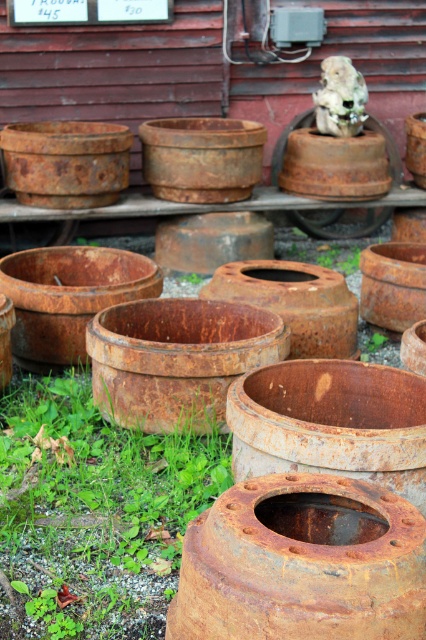
You are standing at the center of the image and want to walk towards the green grass at lower left. In which direction should you move relative to your current position?

Since the green grass at lower left is located at point (97, 508) in 2D coordinates, you should move diagonally towards the lower left direction from your current position at the center to reach it.

You are standing at the lower left corner of the image and want to walk towards the rusty metal tire at center. Is the green grass at lower left blocking your path?

The green grass at lower left is in front of the rusty metal tire at center, so it is blocking your path.

You are a gardener planning to place a new decorative item in the garden. You have a rusty metal tire at center and green grass at lower left. Which object takes up more space in the scene?

The green grass at lower left is larger in size than the rusty metal tire at center, so the green grass at lower left takes up more space in the scene.